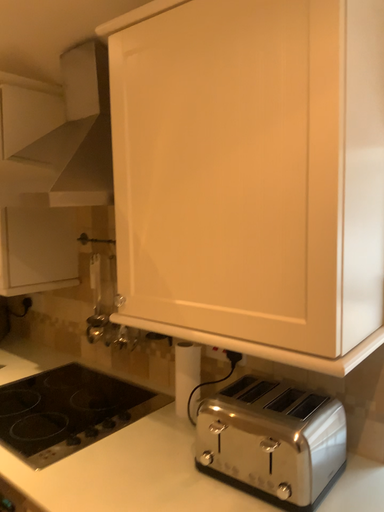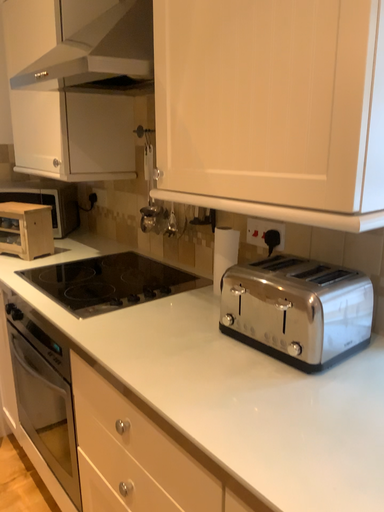
Question: How did the camera likely rotate when shooting the video?

Choices:
 (A) rotated downward
 (B) rotated upward

Answer: (A)